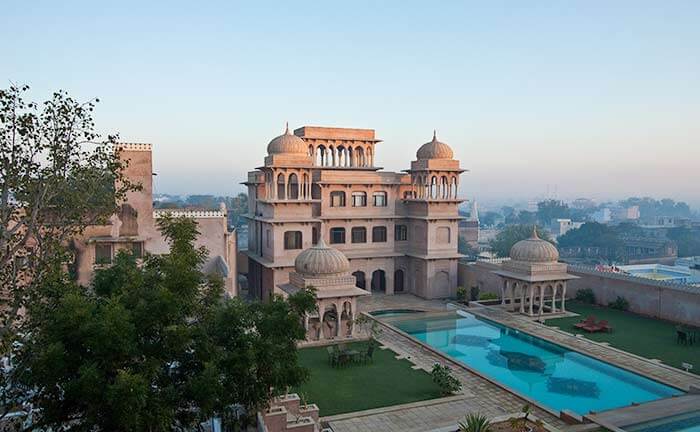
Locate an element on the screen. lounge chairs is located at coordinates (589, 325).